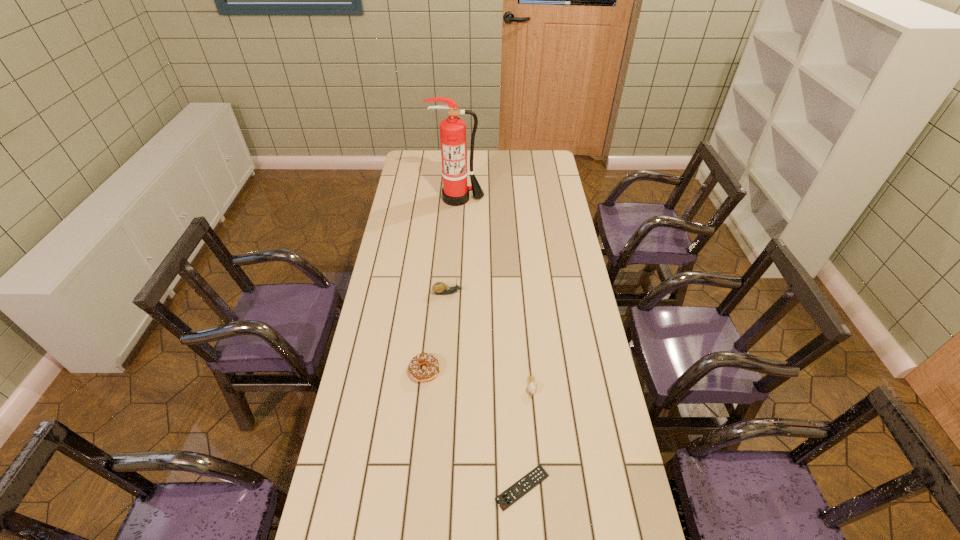
Image resolution: width=960 pixels, height=540 pixels. Identify the location of vacant space situated on the front-facing side of the second tallest object. (544, 293).

In order to click on vacant space located on the right of the doughnut in this screenshot , I will do `click(530, 371)`.

This screenshot has width=960, height=540. Identify the location of vacant space located on the shell of the right escargot. [x=541, y=495].

This screenshot has width=960, height=540. In order to click on blank area located 0.320m on the back of the shortest object in this screenshot , I will do `click(515, 367)`.

Locate an element on the screen. Image resolution: width=960 pixels, height=540 pixels. vacant point at the far edge is located at coordinates 437,165.

Locate an element on the screen. Image resolution: width=960 pixels, height=540 pixels. vacant space at the left edge of the desktop is located at coordinates (377, 341).

The height and width of the screenshot is (540, 960). In order to click on vacant space at the right edge of the desktop in this screenshot , I will do `click(572, 246)`.

Locate an element on the screen. free space at the far left corner of the desktop is located at coordinates [426, 154].

This screenshot has height=540, width=960. I want to click on empty space that is in between the fourth tallest object and the fourth nearest object, so click(x=490, y=340).

Where is `free space between the right escargot and the taller escargot`? free space between the right escargot and the taller escargot is located at coordinates [490, 340].